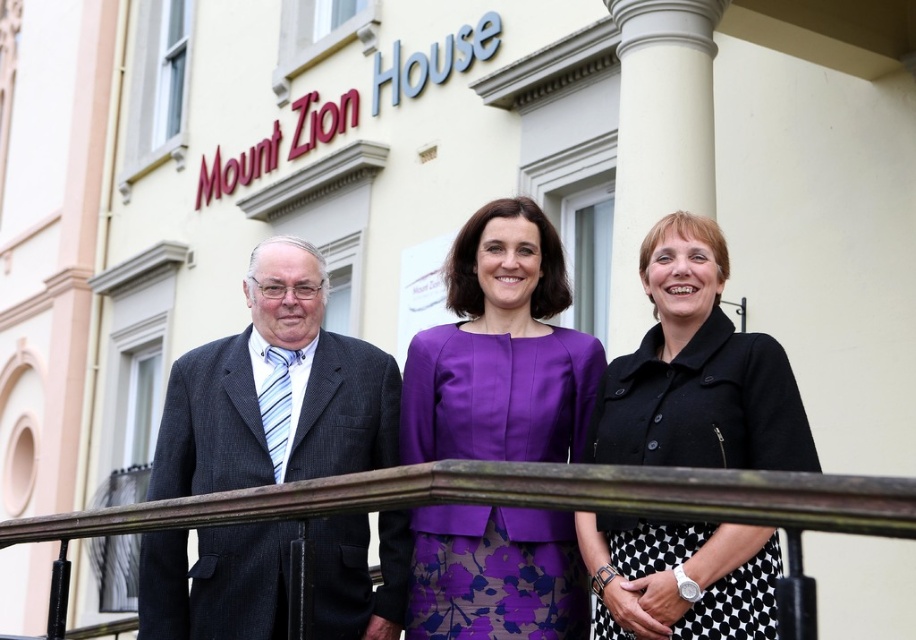
Between matte black suit at center and dark gray pinstripe suit at left, which one is positioned higher?

Positioned higher is matte black suit at center.

Can you confirm if matte black suit at center is bigger than dark gray pinstripe suit at left?

Correct, matte black suit at center is larger in size than dark gray pinstripe suit at left.

Identify the location of matte black suit at center. (595, 362).

Find the location of a particular element. matte black suit at center is located at coordinates (595, 362).

The width and height of the screenshot is (916, 640). Find the location of `purple satin dress at center`. purple satin dress at center is located at coordinates (500, 349).

Does purple satin dress at center appear under brown wooden rail at center?

Correct, purple satin dress at center is located below brown wooden rail at center.

Where is `purple satin dress at center`? The height and width of the screenshot is (640, 916). purple satin dress at center is located at coordinates (500, 349).

Looking at this image, is black matte jacket at center to the left of brown wooden rail at center from the viewer's perspective?

In fact, black matte jacket at center is to the right of brown wooden rail at center.

At what (x,y) coordinates should I click in order to perform the action: click on black matte jacket at center. Please return your answer as a coordinate pair (x, y). Looking at the image, I should click on (696, 371).

Where is `black matte jacket at center`? The image size is (916, 640). black matte jacket at center is located at coordinates (696, 371).